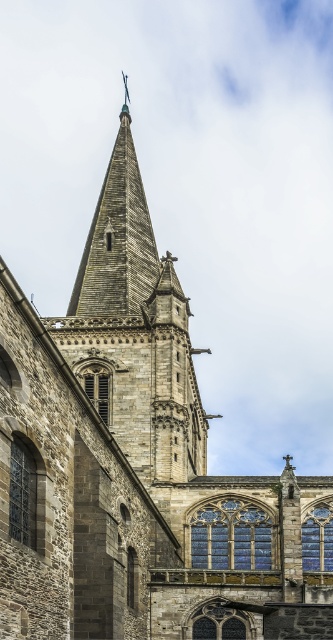
Question: Which point is farther from the camera taking this photo?

Choices:
 (A) (124, 168)
 (B) (120, 388)

Answer: (A)

Question: Is gray stone spire at center in front of stone spire at center?

Choices:
 (A) yes
 (B) no

Answer: (A)

Question: Which point is closer to the camera taking this photo?

Choices:
 (A) (96, 228)
 (B) (195, 438)

Answer: (B)

Question: Is gray stone spire at center in front of stone spire at center?

Choices:
 (A) no
 (B) yes

Answer: (B)

Question: Is gray stone spire at center thinner than stone spire at center?

Choices:
 (A) yes
 (B) no

Answer: (B)

Question: Which point appears farthest from the camera in this image?

Choices:
 (A) (59, 323)
 (B) (118, 269)

Answer: (B)